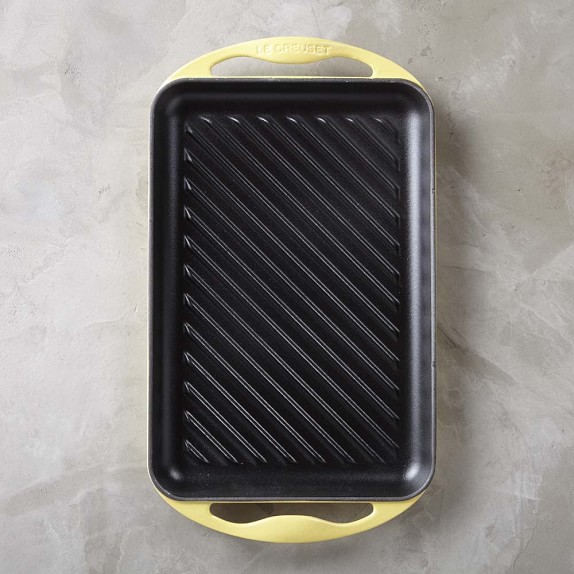
I want to click on kitchen tray, so coord(325,310).